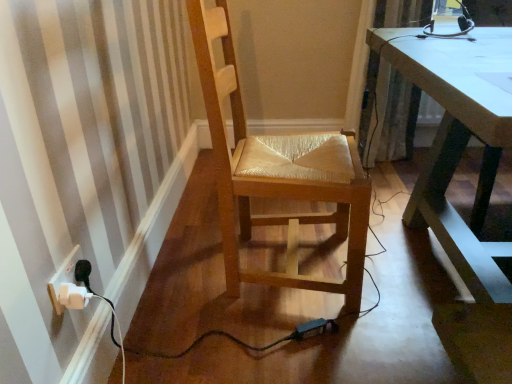
Where is `vacant area to the right of wooden woven seat at center`? vacant area to the right of wooden woven seat at center is located at coordinates (397, 269).